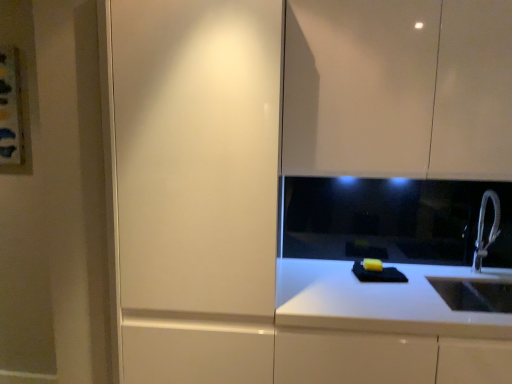
Question: Is matte white cabinet at left taller or shorter than white metallic faucet at right?

Choices:
 (A) short
 (B) tall

Answer: (B)

Question: Do you think matte white cabinet at left is within white metallic faucet at right, or outside of it?

Choices:
 (A) inside
 (B) outside

Answer: (B)

Question: Which object is the closest to the glossy white cabinet at upper right?

Choices:
 (A) white metallic faucet at right
 (B) matte white cabinet at left
 (C) white glossy countertop at lower right

Answer: (B)

Question: Which of these objects is positioned farthest from the white metallic faucet at right?

Choices:
 (A) white glossy countertop at lower right
 (B) matte white cabinet at left
 (C) glossy white cabinet at upper right

Answer: (B)